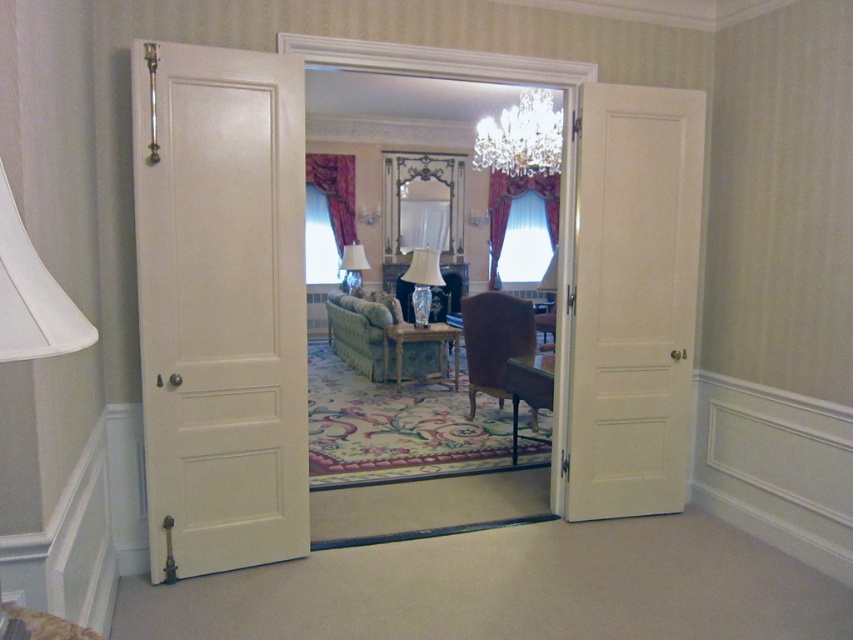
Which of these two, clear crystal chandelier at upper center or green fabric armchair at center, stands shorter?

green fabric armchair at center

Can you confirm if clear crystal chandelier at upper center is smaller than green fabric armchair at center?

Actually, clear crystal chandelier at upper center might be larger than green fabric armchair at center.

Identify the location of clear crystal chandelier at upper center. (521, 138).

Which of these two, white wood door at left or green fabric armchair at center, stands taller?

With more height is white wood door at left.

Is white wood door at left above green fabric armchair at center?

Correct, white wood door at left is located above green fabric armchair at center.

Between point (248, 364) and point (372, 328), which one is positioned behind?

The point (372, 328) is behind.

Find the location of a particular element. This screenshot has width=853, height=640. white wood door at left is located at coordinates (221, 305).

Is green fabric armchair at center to the left of white glossy lampshade at center from the viewer's perspective?

No, green fabric armchair at center is not to the left of white glossy lampshade at center.

Is green fabric armchair at center thinner than white glossy lampshade at center?

Incorrect, green fabric armchair at center's width is not less than white glossy lampshade at center's.

Identify the location of green fabric armchair at center. The height and width of the screenshot is (640, 853). (358, 332).